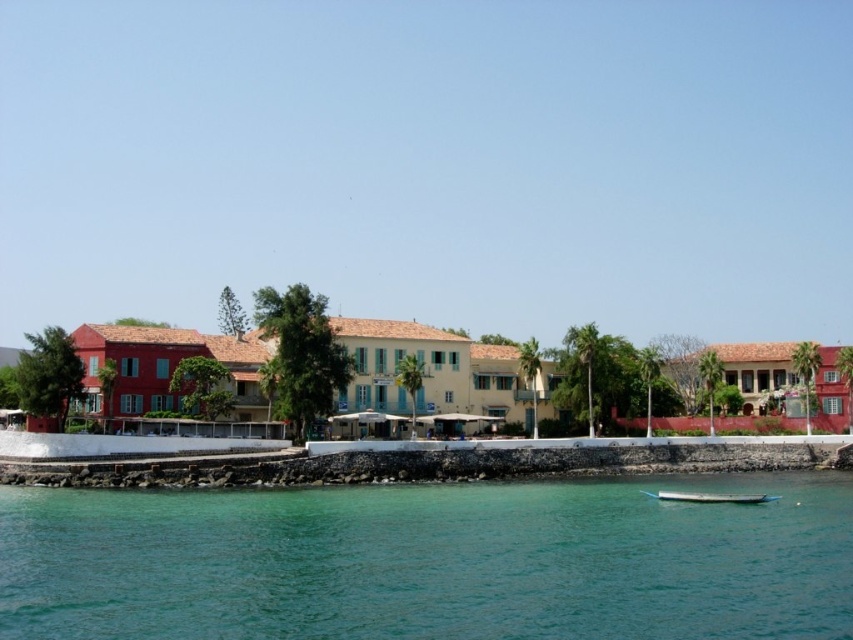
You are standing at the edge of the water in the coastal scene. There is a point marked at coordinates (431,561) which indicates clear water at lower center. If you want to find the clearest water to take a swim, would you head towards that point?

Yes, the point at (431,561) marks clear water at lower center, so heading towards that point would lead you to the clearest water in the scene.